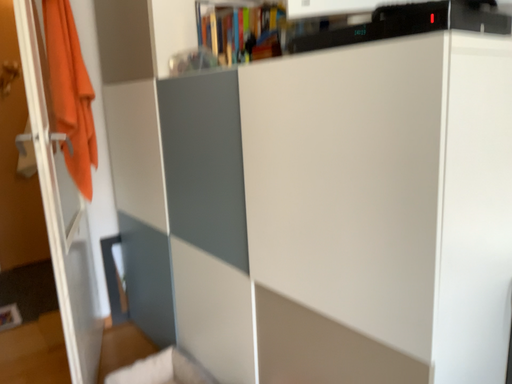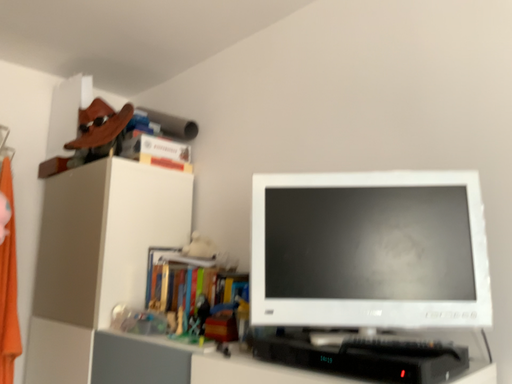
Question: How did the camera likely rotate when shooting the video?

Choices:
 (A) rotated left
 (B) rotated right

Answer: (B)